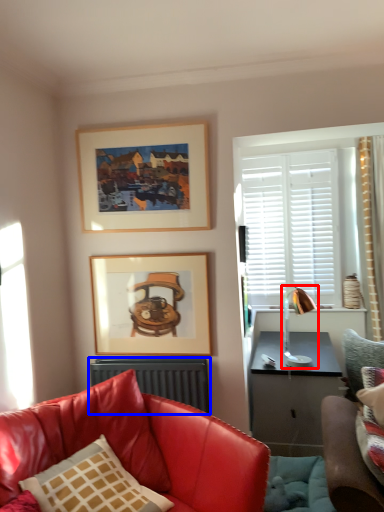
Question: Which of the following is the closest to the observer, lamp (highlighted by a red box) or radiator (highlighted by a blue box)?

Choices:
 (A) lamp
 (B) radiator

Answer: (B)